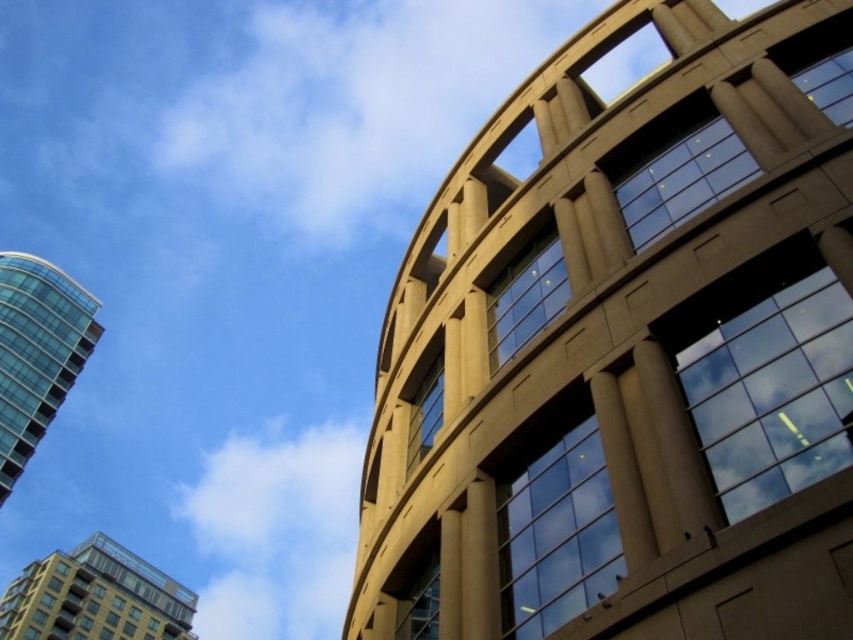
You are an architect analyzing the building heights in the scene. Which of the two buildings, the beige stone building at upper right or the glassy reflective building at lower left, has a greater height?

The beige stone building at upper right is much taller than the glassy reflective building at lower left.

You are an architect analyzing the layout of the scene. You need to determine the relative positioning of the beige stone building at upper right and the glassy teal tower at left. Which one is located to the right side of the other?

The beige stone building at upper right is positioned on the right side of glassy teal tower at left, so the beige stone building at upper right is to the right of the glassy teal tower at left.

You are an architect planning to install a new solar panel array on the roof of the beige stone building at upper right. The array requires a clear line of sight to the sun without obstruction from nearby structures. Given that the glassy teal tower at left is 133.84 meters away, would its height potentially block sunlight from reaching the array during midday?

The distance between the beige stone building at upper right and the glassy teal tower at left is 133.84 meters. However, the height of the glassy teal tower at left is not provided, so it is impossible to determine if it would block sunlight from reaching the array during midday.